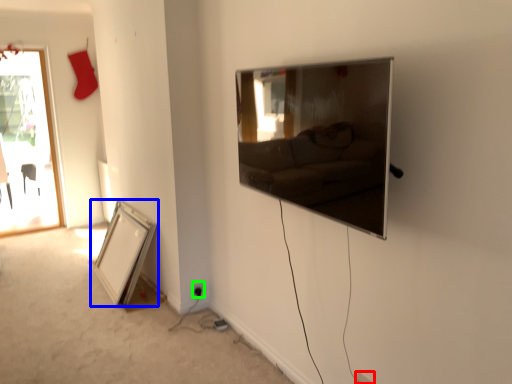
Question: Which object is the closest to the electric outlet (highlighted by a red box)? Choose among these: picture frame (highlighted by a blue box) or electric outlet (highlighted by a green box).

Choices:
 (A) picture frame
 (B) electric outlet

Answer: (B)